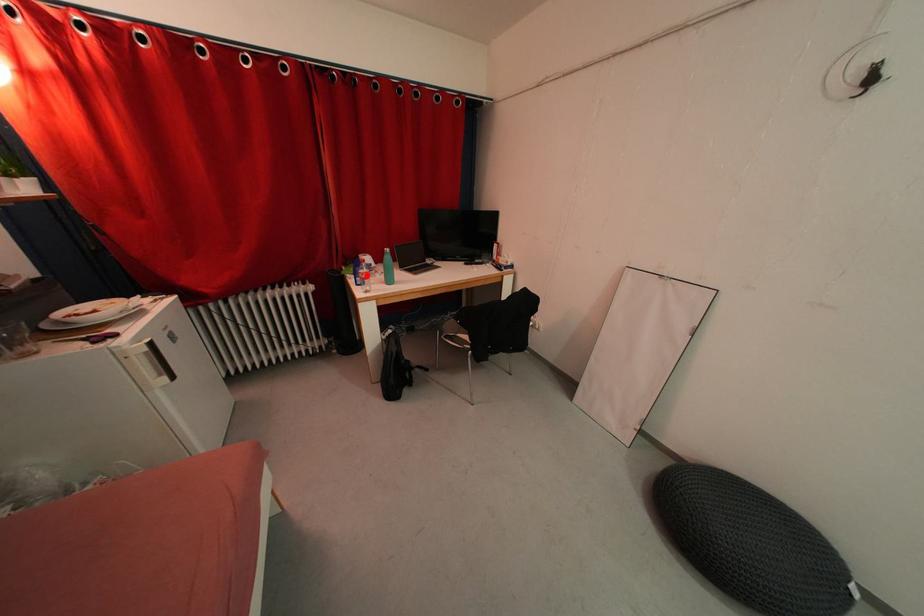
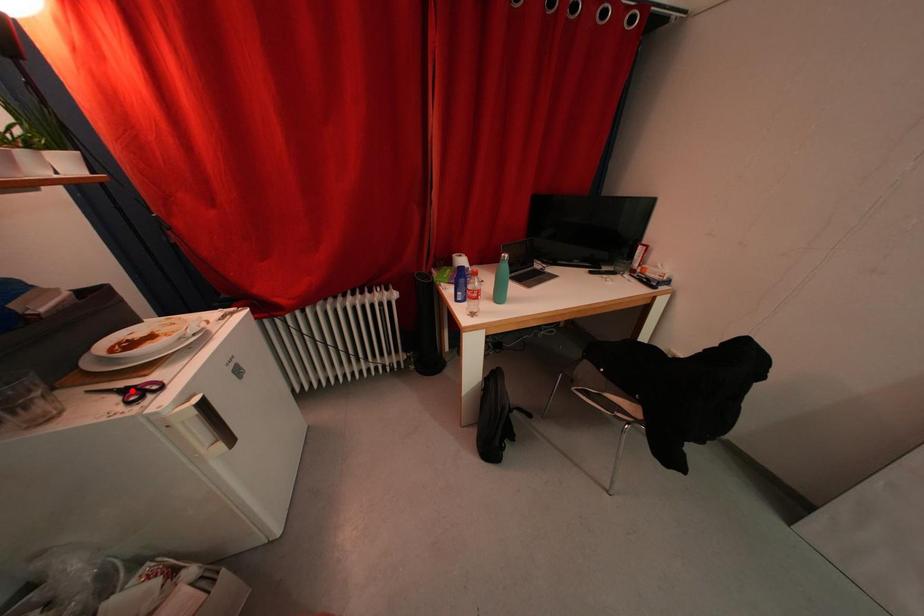
In the scene shown: I am providing you with two images of the same scene from different viewpoints. A red point is marked on the first image and another point is marked on the second image. Is the marked point in image1 the same physical position as the marked point in image2?

No